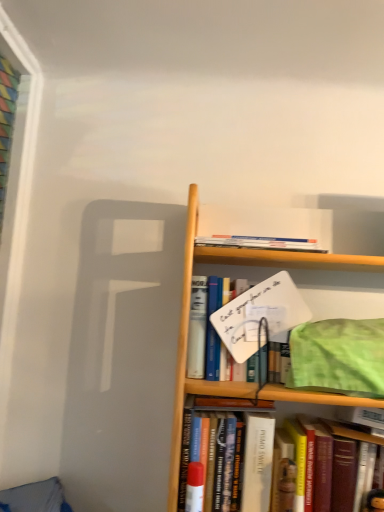
The width and height of the screenshot is (384, 512). I want to click on white paperboard sign at center, which is the fourth book from bottom to top, so click(x=257, y=316).

The height and width of the screenshot is (512, 384). Describe the element at coordinates (257, 316) in the screenshot. I see `white paperboard sign at center, which is the fourth book from bottom to top` at that location.

The height and width of the screenshot is (512, 384). What do you see at coordinates (216, 446) in the screenshot?
I see `hardcover book at center, the 2th book in the bottom-to-top sequence` at bounding box center [216, 446].

Measure the distance between hardcover book at center, which appears as the third book when viewed from the top, and camera.

89.92 centimeters.

What do you see at coordinates (216, 409) in the screenshot? The image size is (384, 512). I see `hardcover book at center, which appears as the third book when viewed from the top` at bounding box center [216, 409].

This screenshot has width=384, height=512. I want to click on white paperboard sign at center, which is the fourth book from bottom to top, so click(x=257, y=316).

Does hardcover book at center, which appears as the 1th book when ordered from the bottom, have a lesser width compared to hardcover book at center, arranged as the third book when ordered from the bottom?

Yes.

How different are the orientations of hardcover book at center, the fifth book in the top-to-bottom sequence, and hardcover book at center, arranged as the third book when ordered from the bottom, in degrees?

0.156 degrees separate the facing orientations of hardcover book at center, the fifth book in the top-to-bottom sequence, and hardcover book at center, arranged as the third book when ordered from the bottom.

Which is more to the right, hardcover book at center, which appears as the 1th book when ordered from the bottom, or hardcover book at center, arranged as the third book when ordered from the bottom?

Positioned to the right is hardcover book at center, which appears as the 1th book when ordered from the bottom.

Do you think hardcover book at center, which appears as the 1th book when ordered from the bottom, is within hardcover book at center, arranged as the third book when ordered from the bottom, or outside of it?

hardcover book at center, which appears as the 1th book when ordered from the bottom, fits inside hardcover book at center, arranged as the third book when ordered from the bottom.

Does white paperboard sign at center, which is the second book from top to bottom, contain hardcover book at center, arranged as the third book when ordered from the bottom?

Definitely not — hardcover book at center, arranged as the third book when ordered from the bottom, is not inside white paperboard sign at center, which is the second book from top to bottom.

From a real-world perspective, is white paperboard sign at center, which is the second book from top to bottom, physically located above or below hardcover book at center, which appears as the third book when viewed from the top?

From a real-world perspective, white paperboard sign at center, which is the second book from top to bottom, is physically above hardcover book at center, which appears as the third book when viewed from the top.

Is white paperboard sign at center, which is the second book from top to bottom, positioned with its back to hardcover book at center, which appears as the third book when viewed from the top?

No, hardcover book at center, which appears as the third book when viewed from the top, is not at the back of white paperboard sign at center, which is the second book from top to bottom.

Is white paperboard sign at center, which is the second book from top to bottom, not near hardcover book at center, arranged as the third book when ordered from the bottom?

That's not correct — white paperboard sign at center, which is the second book from top to bottom, is a little close to hardcover book at center, arranged as the third book when ordered from the bottom.

Looking at this image, is hardcover book at center, the 4th book when ordered from top to bottom, surrounded by white paperboard sign at center, which is the fourth book from bottom to top?

No.

Are white paperboard sign at center, which is the fourth book from bottom to top, and hardcover book at center, the 4th book when ordered from top to bottom, beside each other?

No, white paperboard sign at center, which is the fourth book from bottom to top, is not in contact with hardcover book at center, the 4th book when ordered from top to bottom.

Considering the points (220, 331) and (263, 401), which point is in front, point (220, 331) or point (263, 401)?

The point (263, 401) is more forward.

From a real-world perspective, is white paperboard sign at center, which is the second book from top to bottom, on top of hardcover book at center, the 2th book in the bottom-to-top sequence?

Yes, from a real-world perspective, white paperboard sign at center, which is the second book from top to bottom, is over hardcover book at center, the 2th book in the bottom-to-top sequence

Looking at this image, between hardcover book at center, the 4th book when ordered from top to bottom, and hardcover book at upper center, marked as the 1th book in a top-to-bottom arrangement, which one has smaller size?

hardcover book at upper center, marked as the 1th book in a top-to-bottom arrangement, is smaller.

From a real-world perspective, which is physically above, hardcover book at center, the 4th book when ordered from top to bottom, or hardcover book at upper center, arranged as the fifth book when ordered from the bottom?

hardcover book at upper center, arranged as the fifth book when ordered from the bottom, is physically above.

Is point (182, 505) less distant than point (261, 244)?

Yes.

Is hardcover book at center, the 4th book when ordered from top to bottom, not inside hardcover book at upper center, arranged as the fifth book when ordered from the bottom?

hardcover book at center, the 4th book when ordered from top to bottom, lies outside hardcover book at upper center, arranged as the fifth book when ordered from the bottom,'s area.

Does hardcover book at center, which appears as the 1th book when ordered from the bottom, have a lesser width compared to white paperboard sign at center, which is the second book from top to bottom?

Yes.

Is hardcover book at center, which appears as the 1th book when ordered from the bottom, not close to white paperboard sign at center, which is the fourth book from bottom to top?

No, there isn't a large distance between hardcover book at center, which appears as the 1th book when ordered from the bottom, and white paperboard sign at center, which is the fourth book from bottom to top.

From the image's perspective, between hardcover book at center, which appears as the 1th book when ordered from the bottom, and white paperboard sign at center, which is the second book from top to bottom, who is located below?

From the image's view, hardcover book at center, which appears as the 1th book when ordered from the bottom, is below.

Is hardcover book at center, which appears as the 1th book when ordered from the bottom, oriented towards white paperboard sign at center, which is the second book from top to bottom?

No.

From a real-world perspective, is white paperboard sign at center, which is the second book from top to bottom, below hardcover book at center, the fifth book in the top-to-bottom sequence?

No, from a real-world perspective, white paperboard sign at center, which is the second book from top to bottom, is not beneath hardcover book at center, the fifth book in the top-to-bottom sequence.

Which of these two, white paperboard sign at center, which is the fourth book from bottom to top, or hardcover book at center, which appears as the 1th book when ordered from the bottom, is smaller?

With smaller size is hardcover book at center, which appears as the 1th book when ordered from the bottom.

The width and height of the screenshot is (384, 512). I want to click on the 1st book behind when counting from the white paperboard sign at center, which is the second book from top to bottom, so click(x=319, y=457).

Looking at this image, is hardcover book at center, which appears as the 1th book when ordered from the bottom, beside hardcover book at center, the 4th book when ordered from top to bottom?

hardcover book at center, which appears as the 1th book when ordered from the bottom, is not next to hardcover book at center, the 4th book when ordered from top to bottom, and they're not touching.

From a real-world perspective, is hardcover book at center, the fifth book in the top-to-bottom sequence, positioned above or below hardcover book at center, the 4th book when ordered from top to bottom?

hardcover book at center, the fifth book in the top-to-bottom sequence, is situated lower than hardcover book at center, the 4th book when ordered from top to bottom, in the real world.

How much distance is there between hardcover book at center, the fifth book in the top-to-bottom sequence, and hardcover book at center, the 4th book when ordered from top to bottom?

6.86 inches.

Could hardcover book at center, the 2th book in the bottom-to-top sequence, be considered to be inside hardcover book at center, which appears as the 1th book when ordered from the bottom?

No.

Find the location of a particular element. the 1st book counting from the left side of the hardcover book at center, which appears as the 1th book when ordered from the bottom is located at coordinates (216, 409).

This screenshot has width=384, height=512. What are the coordinates of `book that is the 2nd object located behind the hardcover book at center, arranged as the third book when ordered from the bottom` in the screenshot? It's located at (257, 316).

From the image, which object appears to be farther from hardcover book at center, the fifth book in the top-to-bottom sequence, hardcover book at center, arranged as the third book when ordered from the bottom, or hardcover book at upper center, arranged as the fifth book when ordered from the bottom?

The object further to hardcover book at center, the fifth book in the top-to-bottom sequence, is hardcover book at upper center, arranged as the fifth book when ordered from the bottom.

Estimate the real-world distances between objects in this image. Which object is closer to hardcover book at center, the 2th book in the bottom-to-top sequence, hardcover book at upper center, marked as the 1th book in a top-to-bottom arrangement, or white paperboard sign at center, which is the fourth book from bottom to top?

white paperboard sign at center, which is the fourth book from bottom to top, is positioned closer to the anchor hardcover book at center, the 2th book in the bottom-to-top sequence.

When comparing their distances from hardcover book at center, the 2th book in the bottom-to-top sequence, does white paperboard sign at center, which is the fourth book from bottom to top, or hardcover book at center, arranged as the third book when ordered from the bottom, seem further?

white paperboard sign at center, which is the fourth book from bottom to top.

Which object lies nearer to the anchor point white paperboard sign at center, which is the second book from top to bottom, hardcover book at upper center, arranged as the fifth book when ordered from the bottom, or hardcover book at center, which appears as the third book when viewed from the top?

→ hardcover book at upper center, arranged as the fifth book when ordered from the bottom, is positioned closer to the anchor white paperboard sign at center, which is the second book from top to bottom.

Which object lies nearer to the anchor point hardcover book at upper center, marked as the 1th book in a top-to-bottom arrangement, hardcover book at center, arranged as the third book when ordered from the bottom, or white paperboard sign at center, which is the second book from top to bottom?

white paperboard sign at center, which is the second book from top to bottom, lies closer to hardcover book at upper center, marked as the 1th book in a top-to-bottom arrangement, than the other object.

Based on their spatial positions, is white paperboard sign at center, which is the fourth book from bottom to top, or hardcover book at upper center, arranged as the fifth book when ordered from the bottom, further from hardcover book at center, the 4th book when ordered from top to bottom?

hardcover book at upper center, arranged as the fifth book when ordered from the bottom, is positioned further to the anchor hardcover book at center, the 4th book when ordered from top to bottom.

Estimate the real-world distances between objects in this image. Which object is further from hardcover book at center, the 4th book when ordered from top to bottom, hardcover book at center, which appears as the third book when viewed from the top, or white paperboard sign at center, which is the second book from top to bottom?

white paperboard sign at center, which is the second book from top to bottom, lies further to hardcover book at center, the 4th book when ordered from top to bottom, than the other object.

When comparing their distances from white paperboard sign at center, which is the fourth book from bottom to top, does hardcover book at center, which appears as the 1th book when ordered from the bottom, or hardcover book at upper center, marked as the 1th book in a top-to-bottom arrangement, seem closer?

Among the two, hardcover book at upper center, marked as the 1th book in a top-to-bottom arrangement, is located nearer to white paperboard sign at center, which is the fourth book from bottom to top.

Identify the location of book between white paperboard sign at center, which is the second book from top to bottom, and hardcover book at center, the 4th book when ordered from top to bottom, in the vertical direction. (216, 409).

You are a GUI agent. You are given a task and a screenshot of the screen. Output one action in this format:
    pyautogui.click(x=<x>, y=<y>)
    Task: Click on the book between hardcover book at upper center, marked as the 1th book in a top-to-bottom arrangement, and hardcover book at center, which appears as the third book when viewed from the top, in the vertical direction
    
    Given the screenshot: What is the action you would take?
    pyautogui.click(x=257, y=316)